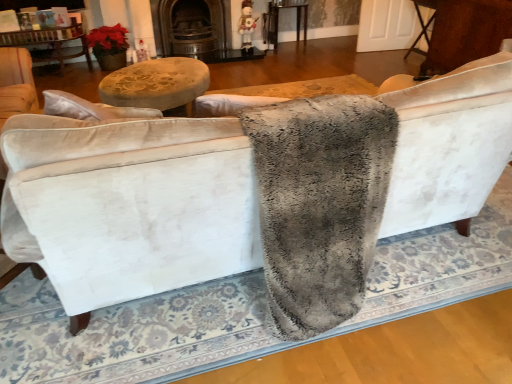
Question: Is dark brown wood fireplace at upper center at the left side of wooden table at center, placed as the 2th table when sorted from front to back?

Choices:
 (A) no
 (B) yes

Answer: (B)

Question: From the image's perspective, is dark brown wood fireplace at upper center beneath wooden table at center, placed as the 2th table when sorted from front to back?

Choices:
 (A) no
 (B) yes

Answer: (B)

Question: Is dark brown wood fireplace at upper center placed right next to wooden table at center, placed as the 1th table when sorted from back to front?

Choices:
 (A) no
 (B) yes

Answer: (A)

Question: Does dark brown wood fireplace at upper center turn towards wooden table at center, acting as the 1th table starting from the left?

Choices:
 (A) no
 (B) yes

Answer: (A)

Question: Is dark brown wood fireplace at upper center shorter than wooden table at center, placed as the 2th table when sorted from front to back?

Choices:
 (A) no
 (B) yes

Answer: (A)

Question: Looking at the image, does gray fluffy blanket at center seem bigger or smaller compared to brown wood table at right, the second table positioned from the left?

Choices:
 (A) big
 (B) small

Answer: (A)

Question: Would you say gray fluffy blanket at center is to the left or to the right of brown wood table at right, the second table positioned from the left, in the picture?

Choices:
 (A) right
 (B) left

Answer: (B)

Question: From the image's perspective, is gray fluffy blanket at center positioned above or below brown wood table at right, which appears as the 1th table when viewed from the front?

Choices:
 (A) above
 (B) below

Answer: (B)

Question: Is point (273, 129) closer or farther from the camera than point (435, 16)?

Choices:
 (A) closer
 (B) farther

Answer: (A)

Question: From a real-world perspective, is dark brown wood fireplace at upper center above or below gray fluffy blanket at center?

Choices:
 (A) above
 (B) below

Answer: (B)

Question: Does point (195, 6) appear closer or farther from the camera than point (325, 180)?

Choices:
 (A) closer
 (B) farther

Answer: (B)

Question: Is dark brown wood fireplace at upper center situated inside gray fluffy blanket at center or outside?

Choices:
 (A) outside
 (B) inside

Answer: (A)

Question: Considering the positions of dark brown wood fireplace at upper center and gray fluffy blanket at center in the image, is dark brown wood fireplace at upper center wider or thinner than gray fluffy blanket at center?

Choices:
 (A) wide
 (B) thin

Answer: (B)

Question: Based on their positions, is gray fluffy blanket at center located to the left or right of dark brown wood fireplace at upper center?

Choices:
 (A) right
 (B) left

Answer: (A)

Question: Is gray fluffy blanket at center bigger or smaller than dark brown wood fireplace at upper center?

Choices:
 (A) big
 (B) small

Answer: (A)